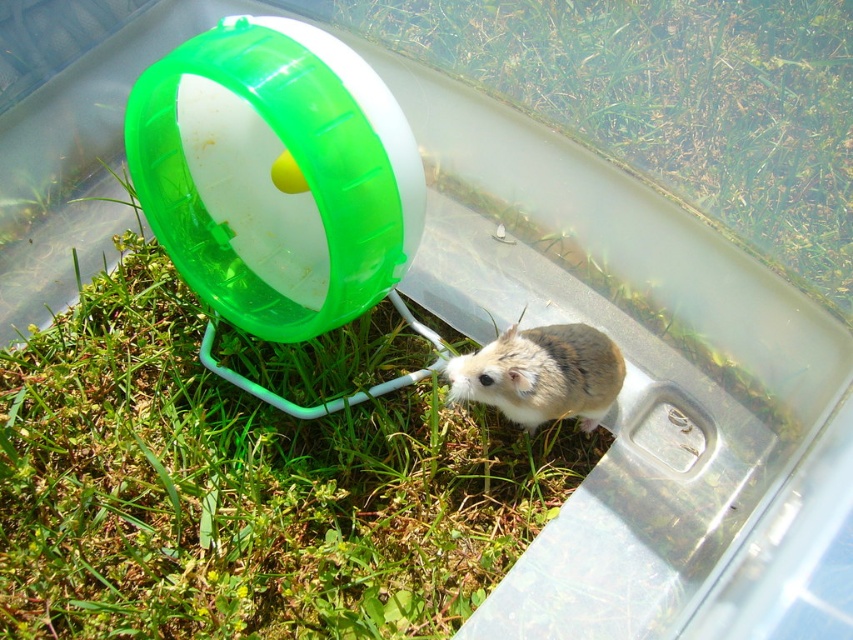
Looking at this image, is green grass at lower left above green grass at lower center?

Actually, green grass at lower left is below green grass at lower center.

The width and height of the screenshot is (853, 640). I want to click on green grass at lower left, so (x=248, y=477).

Image resolution: width=853 pixels, height=640 pixels. Find the location of `green grass at lower left`. green grass at lower left is located at coordinates (248, 477).

What do you see at coordinates (675, 100) in the screenshot? I see `green grass at lower center` at bounding box center [675, 100].

What do you see at coordinates (675, 100) in the screenshot?
I see `green grass at lower center` at bounding box center [675, 100].

Locate an element on the screen. The width and height of the screenshot is (853, 640). green grass at lower center is located at coordinates (675, 100).

Is green grass at lower left to the right of fuzzy brown hamster at center from the viewer's perspective?

Incorrect, green grass at lower left is not on the right side of fuzzy brown hamster at center.

Is point (312, 376) more distant than point (502, 346)?

Yes, it is behind point (502, 346).

You are a GUI agent. You are given a task and a screenshot of the screen. Output one action in this format:
    pyautogui.click(x=<x>, y=<y>)
    Task: Click on the green grass at lower left
    The height and width of the screenshot is (640, 853).
    Given the screenshot: What is the action you would take?
    pyautogui.click(x=248, y=477)